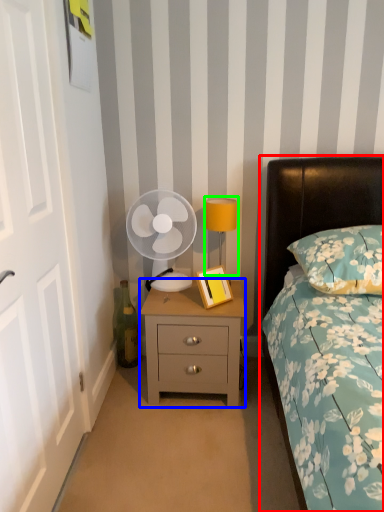
Question: Which object is the farthest from bed (highlighted by a red box)? Choose among these: nightstand (highlighted by a blue box) or bedside lamp (highlighted by a green box).

Choices:
 (A) nightstand
 (B) bedside lamp

Answer: (A)